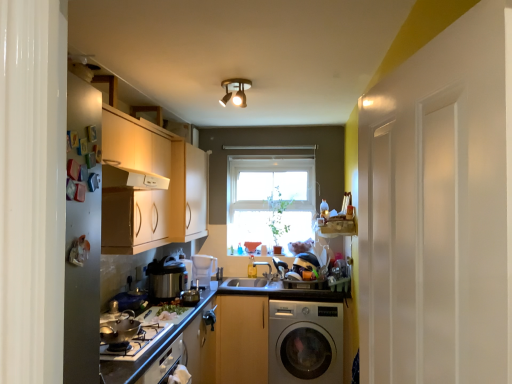
Where is `vacant space situated above gold metallic spotlight at center (from a real-world perspective)`? This screenshot has width=512, height=384. vacant space situated above gold metallic spotlight at center (from a real-world perspective) is located at coordinates (238, 81).